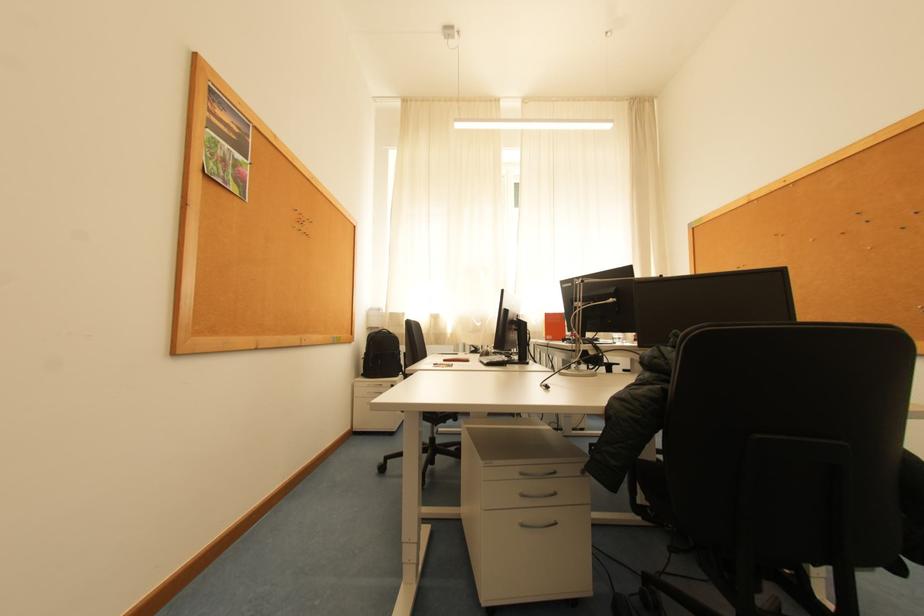
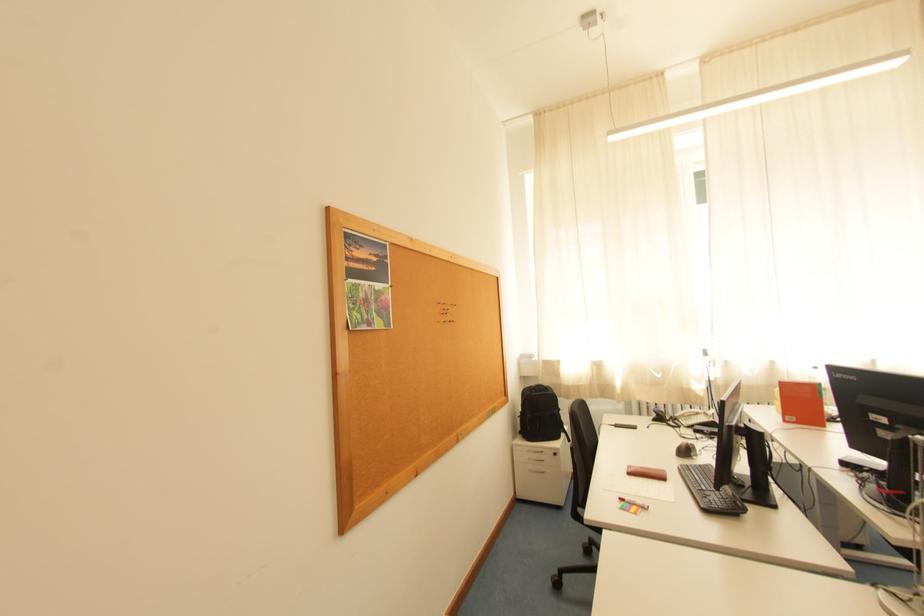
Question: The camera is either moving clockwise (left) or counter-clockwise (right) around the object. The first image is from the beginning of the video and the second image is from the end. Is the camera moving left or right when shooting the video?

Choices:
 (A) Left
 (B) Right

Answer: (B)